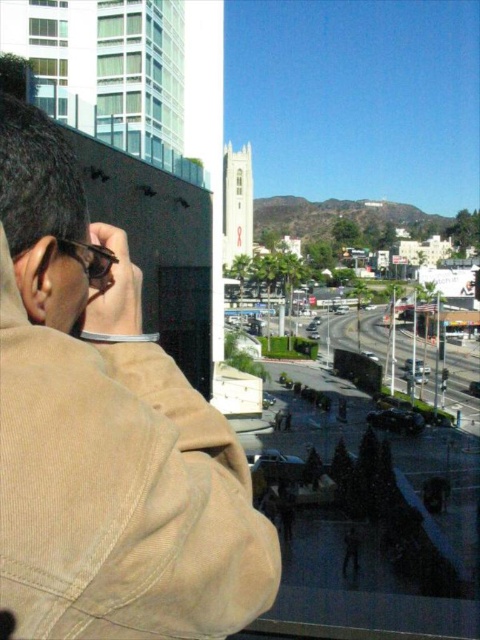
Looking at this image, does tan corduroy trench coat at upper left appear over clear glass window at upper left?

No, tan corduroy trench coat at upper left is not above clear glass window at upper left.

Based on the photo, between tan corduroy trench coat at upper left and clear glass window at upper left, which one has more height?

With more height is tan corduroy trench coat at upper left.

This screenshot has height=640, width=480. In order to click on tan corduroy trench coat at upper left in this screenshot , I will do `click(120, 492)`.

In the scene shown: Is tan corduroy trench coat at upper left closer to the viewer compared to green glass window at upper left?

Yes, tan corduroy trench coat at upper left is closer to the viewer.

Looking at this image, who is more distant from viewer, (265, 525) or (64, 4)?

The point (64, 4) is behind.

Locate an element on the screen. Image resolution: width=480 pixels, height=640 pixels. tan corduroy trench coat at upper left is located at coordinates (120, 492).

Is clear glass window at upper left to the left of green glass window at upper left from the viewer's perspective?

Incorrect, clear glass window at upper left is not on the left side of green glass window at upper left.

This screenshot has width=480, height=640. What do you see at coordinates (48, 32) in the screenshot?
I see `clear glass window at upper left` at bounding box center [48, 32].

Measure the distance between clear glass window at upper left and camera.

The distance of clear glass window at upper left from camera is 266.19 feet.

Locate an element on the screen. The image size is (480, 640). clear glass window at upper left is located at coordinates (48, 32).